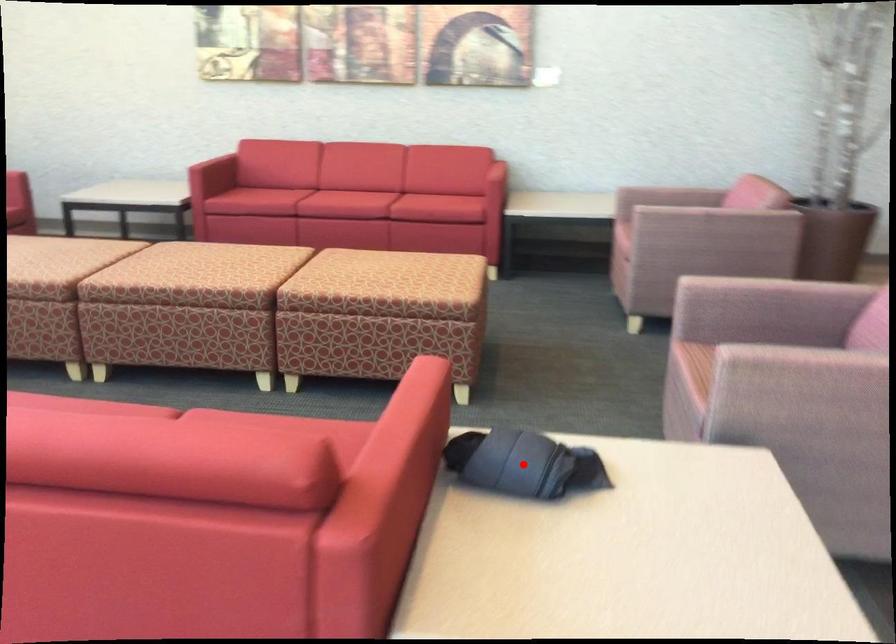
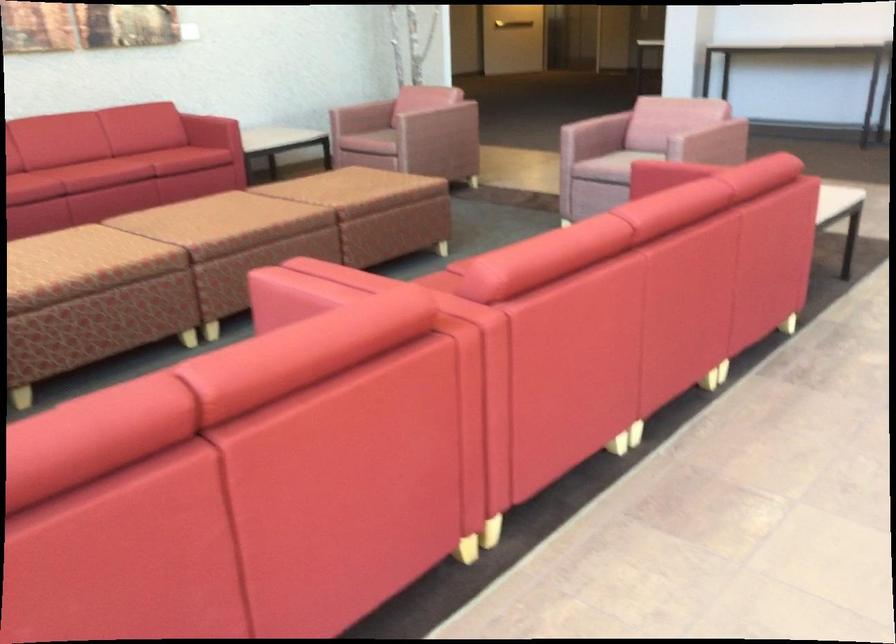
Question: I am providing you with two images of the same scene from different viewpoints. A red point is marked on the first image. Can you still see the location of the red point in image 2?

Choices:
 (A) Yes
 (B) No

Answer: (B)